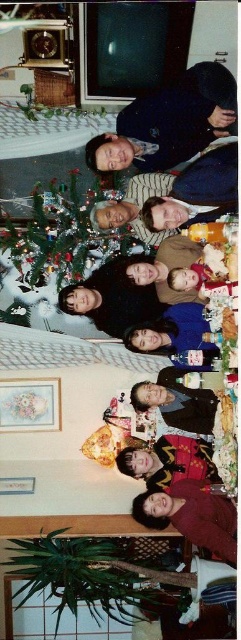
You are a photographer trying to capture a group photo of the attendees at this festive gathering. You want to ensure both the matte black sweater at upper center and the pastel floral fabric picture frame at lower left are visible in the shot. Based on their positions, which object should you position closer to the left side of the camera frame to include both in the photo?

The pastel floral fabric picture frame at lower left should be positioned closer to the left side of the camera frame since the matte black sweater at upper center is already to the right of it, ensuring both can be captured within the shot.

You are a photographer at this festive gathering and want to position yourself so that both the dark brown leather jacket at center and the blue velvet dress at center are visible in your shot. Since you need to ensure the jacket is to the right of the dress in the photo, where should you stand relative to the subjects?

You should stand to the left of the subjects so that the dark brown leather jacket at center appears to the right of the blue velvet dress at center in the photo, as described.